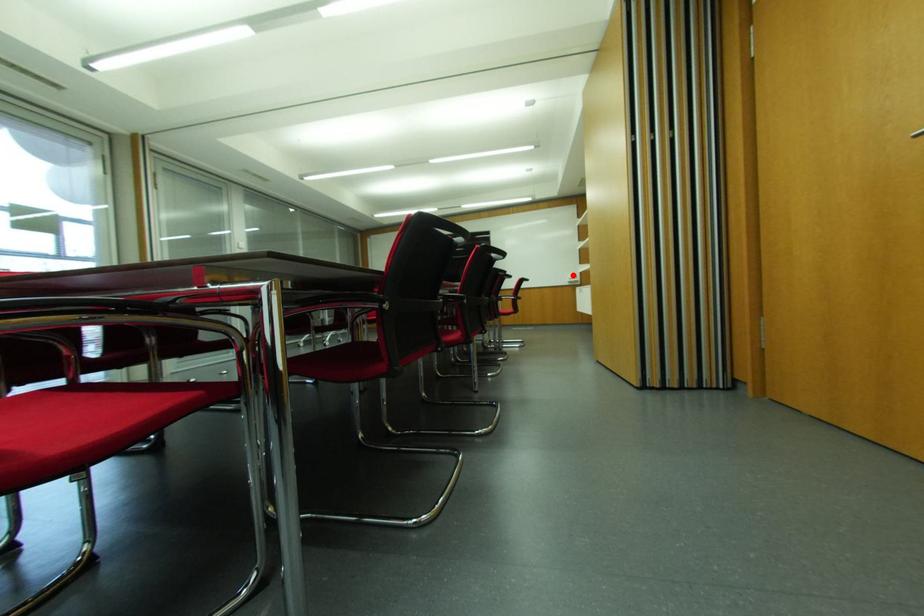
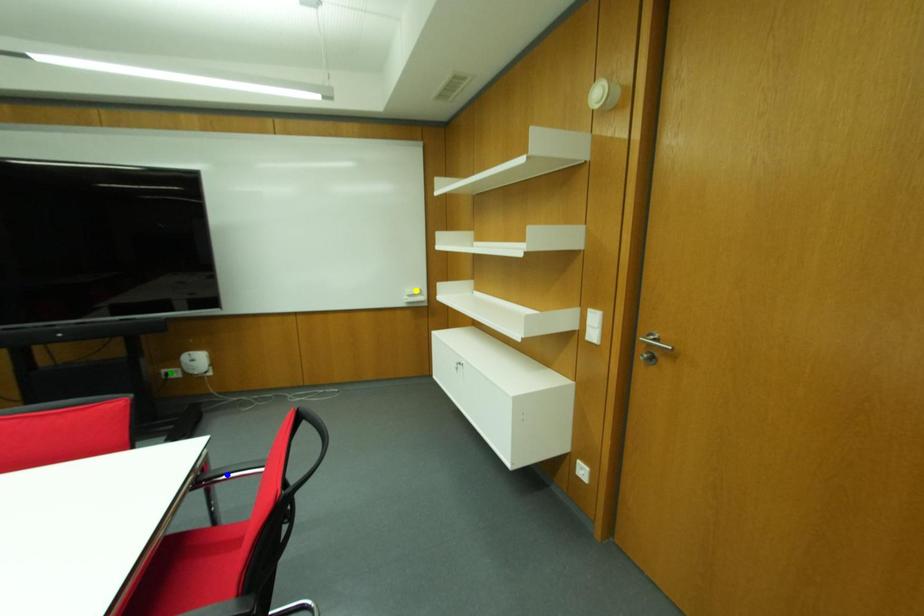
Question: I am providing you with two images of the same scene from different viewpoints. A red point is marked on the first image. You are given multiple points on the second image. Can you choose the point in image 2 that corresponds to the point in image 1?

Choices:
 (A) yellow point
 (B) green point
 (C) blue point

Answer: (A)